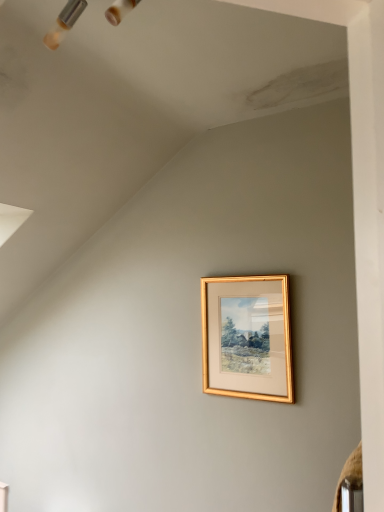
Describe the element at coordinates (247, 337) in the screenshot. The height and width of the screenshot is (512, 384). I see `gold metallic picture frame at center` at that location.

The image size is (384, 512). I want to click on gold metallic picture frame at center, so click(x=247, y=337).

The height and width of the screenshot is (512, 384). Identify the location of gold metallic picture frame at center. (247, 337).